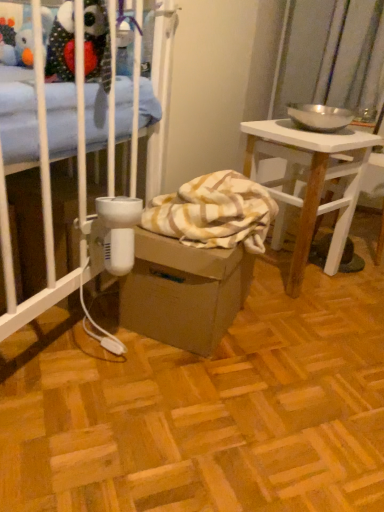
What do you see at coordinates (183, 292) in the screenshot? I see `brown cardboard box at center` at bounding box center [183, 292].

What are the coordinates of `brown cardboard box at center` in the screenshot? It's located at (183, 292).

What do you see at coordinates (311, 181) in the screenshot?
I see `white wood desk at right` at bounding box center [311, 181].

What is the approximate width of white wood desk at right?

The width of white wood desk at right is 12.73 inches.

Find the location of a particular element. This screenshot has width=384, height=512. white wood desk at right is located at coordinates (311, 181).

This screenshot has width=384, height=512. I want to click on brown cardboard box at center, so click(x=183, y=292).

Which is more to the right, white wood desk at right or brown cardboard box at center?

From the viewer's perspective, white wood desk at right appears more on the right side.

Consider the image. Does white wood desk at right come in front of brown cardboard box at center?

No.

Which is behind, point (306, 253) or point (194, 312)?

Positioned behind is point (306, 253).

From the image's perspective, relative to brown cardboard box at center, is white wood desk at right above or below?

From the image's perspective, white wood desk at right appears above brown cardboard box at center.

From a real-world perspective, which object stands above the other?

white wood desk at right, from a real-world perspective.

From the picture: Is white wood desk at right wider than brown cardboard box at center?

Indeed, white wood desk at right has a greater width compared to brown cardboard box at center.

Between white wood desk at right and brown cardboard box at center, which one has less height?

brown cardboard box at center is shorter.

Who is bigger, white wood desk at right or brown cardboard box at center?

white wood desk at right is bigger.

Is white wood desk at right outside of brown cardboard box at center?

white wood desk at right lies outside brown cardboard box at center's area.

Consider the image. Is white wood desk at right next to brown cardboard box at center?

No, white wood desk at right is not beside brown cardboard box at center.

Is white wood desk at right facing away from brown cardboard box at center?

No, white wood desk at right is not facing away from brown cardboard box at center.

What's the angular difference between white wood desk at right and brown cardboard box at center's facing directions?

There is a 27-degree angle between the facing directions of white wood desk at right and brown cardboard box at center.

Identify the location of desk on the right of the brown cardboard box at center. (311, 181).

Considering the relative positions of brown cardboard box at center and white wood desk at right in the image provided, is brown cardboard box at center to the left of white wood desk at right from the viewer's perspective?

Yes, brown cardboard box at center is to the left of white wood desk at right.

Is brown cardboard box at center further to camera compared to white wood desk at right?

That is False.

Which is in front, point (170, 303) or point (301, 219)?

The point (170, 303) is in front.

In the scene shown: From the image's perspective, is brown cardboard box at center on white wood desk at right?

Actually, brown cardboard box at center appears below white wood desk at right in the image.

From a real-world perspective, who is located lower, brown cardboard box at center or white wood desk at right?

brown cardboard box at center.

Can you confirm if brown cardboard box at center is wider than white wood desk at right?

No.

Which of these two, brown cardboard box at center or white wood desk at right, stands shorter?

brown cardboard box at center.

Who is smaller, brown cardboard box at center or white wood desk at right?

brown cardboard box at center.

Would you say white wood desk at right is part of brown cardboard box at center's contents?

No.

Is brown cardboard box at center far away from white wood desk at right?

No, brown cardboard box at center is not far away from white wood desk at right.

Is brown cardboard box at center facing away from white wood desk at right?

brown cardboard box at center is not turned away from white wood desk at right.

How many degrees apart are the facing directions of brown cardboard box at center and white wood desk at right?

The angular difference between brown cardboard box at center and white wood desk at right is 27 degrees.

The width and height of the screenshot is (384, 512). I want to click on desk above the brown cardboard box at center (from the image's perspective), so click(311, 181).

Where is `desk above the brown cardboard box at center (from the image's perspective)`? This screenshot has width=384, height=512. desk above the brown cardboard box at center (from the image's perspective) is located at coordinates (311, 181).

The width and height of the screenshot is (384, 512). I want to click on cardboard box below the white wood desk at right (from the image's perspective), so click(x=183, y=292).